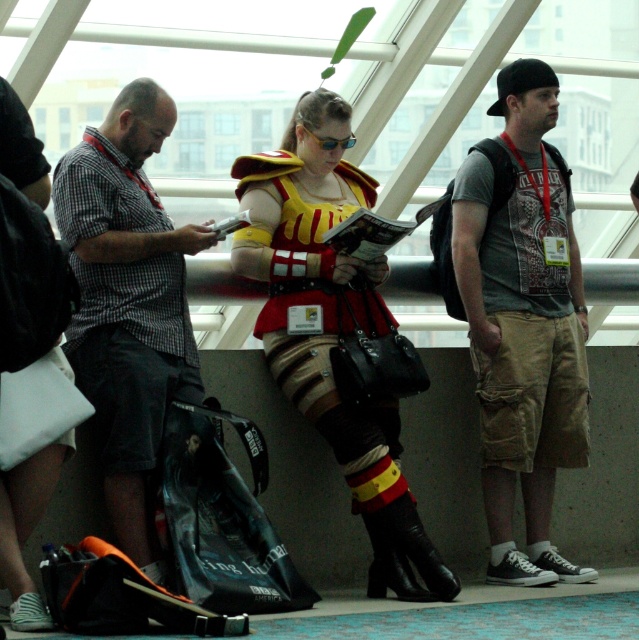
You are standing in the convention center and see the khaki cargo shorts at right and the matte red armor at center. Which object is positioned farther to the east?

The khaki cargo shorts at right is positioned to the right of the matte red armor at center, so it is farther to the east.

You are standing at point [302,381] and want to walk to point [578,324]. Is there a clear path between these two points?

Point [578,324] is behind point [302,381], so there may be an obstruction between them. You might need to go around or check for a clear path.